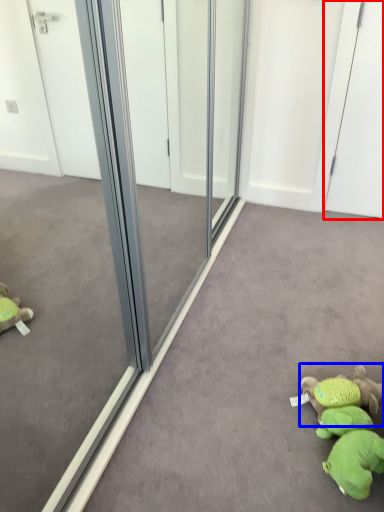
Question: Which point is closer to the camera, screen door (highlighted by a red box) or toy (highlighted by a blue box)?

Choices:
 (A) screen door
 (B) toy

Answer: (B)